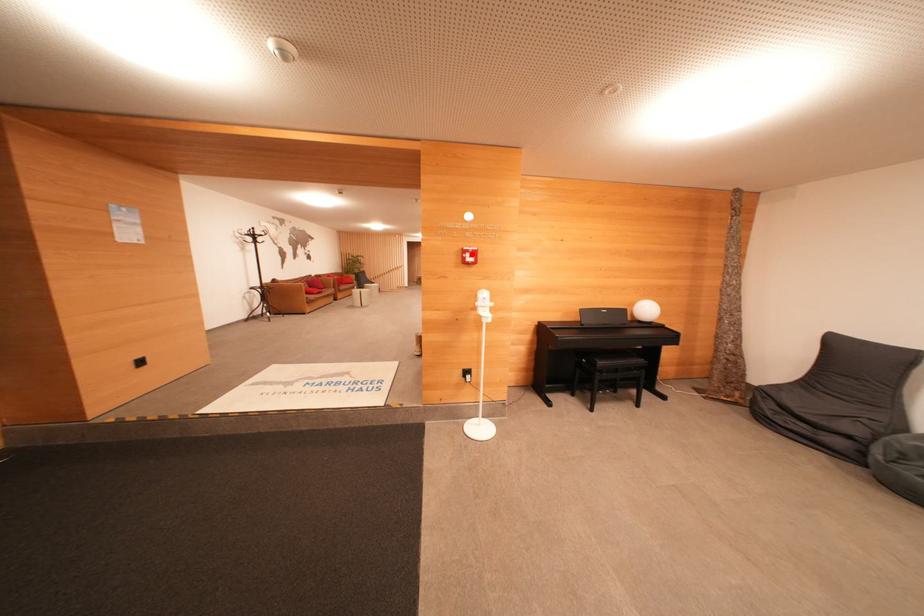
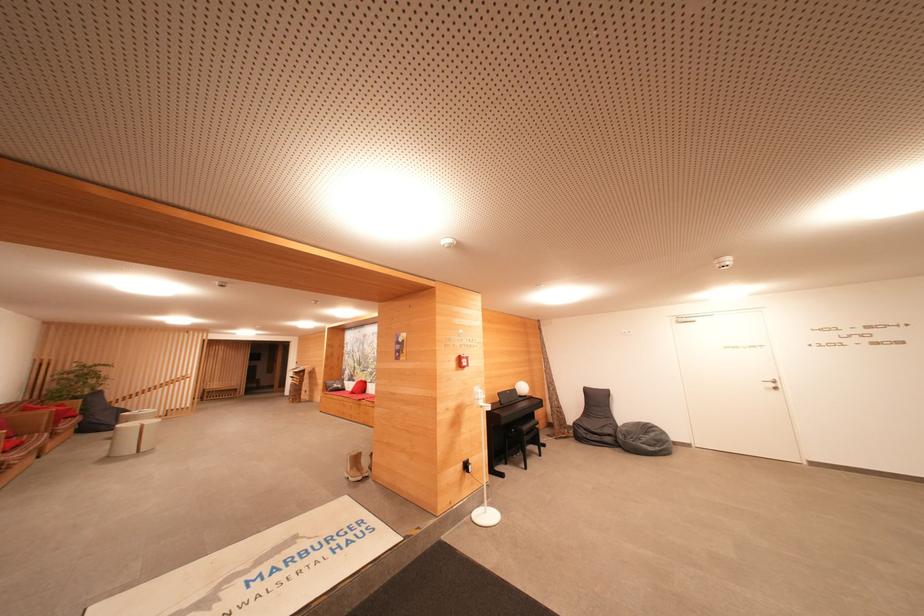
Locate, in the second image, the point that corresponds to the highlighted location in the first image.

(468, 361)